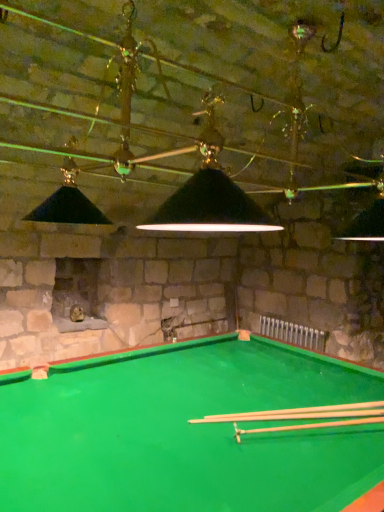
Locate an element on the screen. wooden cue at center, arranged as the 1th cue when viewed from the front is located at coordinates (310, 426).

The image size is (384, 512). Describe the element at coordinates (310, 426) in the screenshot. I see `wooden cue at center, which is the 2th cue in back-to-front order` at that location.

At what (x,y) coordinates should I click in order to perform the action: click on smooth wood cue at center, the 1th cue positioned from the back. Please return your answer as a coordinate pair (x, y). Looking at the image, I should click on (301, 413).

Describe the element at coordinates (301, 413) in the screenshot. This screenshot has height=512, width=384. I see `smooth wood cue at center, which appears as the 2th cue when viewed from the front` at that location.

What is the approximate width of smooth wood cue at center, which appears as the 2th cue when viewed from the front?

36.11 inches.

How much space does smooth wood cue at center, which appears as the 2th cue when viewed from the front, occupy vertically?

smooth wood cue at center, which appears as the 2th cue when viewed from the front, is 1.60 inches tall.

Where is `wooden cue at center, which is the 2th cue in back-to-front order`? The image size is (384, 512). wooden cue at center, which is the 2th cue in back-to-front order is located at coordinates (310, 426).

Considering the positions of objects wooden cue at center, arranged as the 1th cue when viewed from the front, and smooth wood cue at center, which appears as the 2th cue when viewed from the front, in the image provided, who is more to the left, wooden cue at center, arranged as the 1th cue when viewed from the front, or smooth wood cue at center, which appears as the 2th cue when viewed from the front,?

Positioned to the left is smooth wood cue at center, which appears as the 2th cue when viewed from the front.

Considering the positions of objects wooden cue at center, which is the 2th cue in back-to-front order, and smooth wood cue at center, the 1th cue positioned from the back, in the image provided, who is behind, wooden cue at center, which is the 2th cue in back-to-front order, or smooth wood cue at center, the 1th cue positioned from the back,?

Positioned behind is smooth wood cue at center, the 1th cue positioned from the back.

Which is farther from the camera, (x=366, y=416) or (x=333, y=417)?

Answer: The point (x=366, y=416) is farther.

From the image's perspective, who appears lower, wooden cue at center, which is the 2th cue in back-to-front order, or smooth wood cue at center, the 1th cue positioned from the back?

From the image's view, smooth wood cue at center, the 1th cue positioned from the back, is below.

From a real-world perspective, is wooden cue at center, arranged as the 1th cue when viewed from the front, on top of smooth wood cue at center, the 1th cue positioned from the back?

Yes, from a real-world perspective, wooden cue at center, arranged as the 1th cue when viewed from the front, is on top of smooth wood cue at center, the 1th cue positioned from the back.

Is wooden cue at center, arranged as the 1th cue when viewed from the front, wider than smooth wood cue at center, which appears as the 2th cue when viewed from the front?

Incorrect, the width of wooden cue at center, arranged as the 1th cue when viewed from the front, does not surpass that of smooth wood cue at center, which appears as the 2th cue when viewed from the front.

Considering the sizes of objects wooden cue at center, which is the 2th cue in back-to-front order, and smooth wood cue at center, which appears as the 2th cue when viewed from the front, in the image provided, who is taller, wooden cue at center, which is the 2th cue in back-to-front order, or smooth wood cue at center, which appears as the 2th cue when viewed from the front,?

wooden cue at center, which is the 2th cue in back-to-front order.

Which of these two, wooden cue at center, arranged as the 1th cue when viewed from the front, or smooth wood cue at center, which appears as the 2th cue when viewed from the front, is smaller?

smooth wood cue at center, which appears as the 2th cue when viewed from the front.

Do you think wooden cue at center, arranged as the 1th cue when viewed from the front, is within smooth wood cue at center, which appears as the 2th cue when viewed from the front, or outside of it?

wooden cue at center, arranged as the 1th cue when viewed from the front, exists outside the volume of smooth wood cue at center, which appears as the 2th cue when viewed from the front.

Are wooden cue at center, arranged as the 1th cue when viewed from the front, and smooth wood cue at center, which appears as the 2th cue when viewed from the front, far apart?

They are positioned close to each other.

Is wooden cue at center, arranged as the 1th cue when viewed from the front, aimed at smooth wood cue at center, the 1th cue positioned from the back?

No, wooden cue at center, arranged as the 1th cue when viewed from the front, is not facing towards smooth wood cue at center, the 1th cue positioned from the back.

Can you tell me how much wooden cue at center, arranged as the 1th cue when viewed from the front, and smooth wood cue at center, which appears as the 2th cue when viewed from the front, differ in facing direction?

wooden cue at center, arranged as the 1th cue when viewed from the front, and smooth wood cue at center, which appears as the 2th cue when viewed from the front, are facing 2.21 degrees away from each other.

The image size is (384, 512). I want to click on cue that appears on the left of wooden cue at center, arranged as the 1th cue when viewed from the front, so click(x=301, y=413).

Between smooth wood cue at center, the 1th cue positioned from the back, and wooden cue at center, arranged as the 1th cue when viewed from the front, which one appears on the left side from the viewer's perspective?

smooth wood cue at center, the 1th cue positioned from the back, is more to the left.

Does smooth wood cue at center, which appears as the 2th cue when viewed from the front, lie behind wooden cue at center, arranged as the 1th cue when viewed from the front?

Yes, it is behind wooden cue at center, arranged as the 1th cue when viewed from the front.

Consider the image. Which point is more forward, (333, 411) or (323, 422)?

Point (323, 422)

From the image's perspective, between smooth wood cue at center, which appears as the 2th cue when viewed from the front, and wooden cue at center, which is the 2th cue in back-to-front order, who is located below?

smooth wood cue at center, which appears as the 2th cue when viewed from the front, from the image's perspective.

In the scene shown: From a real-world perspective, is smooth wood cue at center, which appears as the 2th cue when viewed from the front, beneath wooden cue at center, which is the 2th cue in back-to-front order?

Yes.

Which of these two, smooth wood cue at center, the 1th cue positioned from the back, or wooden cue at center, arranged as the 1th cue when viewed from the front, is thinner?

wooden cue at center, arranged as the 1th cue when viewed from the front, is thinner.

Considering the sizes of objects smooth wood cue at center, the 1th cue positioned from the back, and wooden cue at center, arranged as the 1th cue when viewed from the front, in the image provided, who is shorter, smooth wood cue at center, the 1th cue positioned from the back, or wooden cue at center, arranged as the 1th cue when viewed from the front,?

smooth wood cue at center, the 1th cue positioned from the back.

Who is smaller, smooth wood cue at center, the 1th cue positioned from the back, or wooden cue at center, arranged as the 1th cue when viewed from the front?

smooth wood cue at center, the 1th cue positioned from the back, is smaller.

Do you think smooth wood cue at center, the 1th cue positioned from the back, is within wooden cue at center, arranged as the 1th cue when viewed from the front, or outside of it?

smooth wood cue at center, the 1th cue positioned from the back, cannot be found inside wooden cue at center, arranged as the 1th cue when viewed from the front.

Looking at this image, is smooth wood cue at center, the 1th cue positioned from the back, far away from wooden cue at center, which is the 2th cue in back-to-front order?

That's not correct — smooth wood cue at center, the 1th cue positioned from the back, is a little close to wooden cue at center, which is the 2th cue in back-to-front order.

Is wooden cue at center, which is the 2th cue in back-to-front order, at the back of smooth wood cue at center, which appears as the 2th cue when viewed from the front?

No, smooth wood cue at center, which appears as the 2th cue when viewed from the front, is not facing the opposite direction of wooden cue at center, which is the 2th cue in back-to-front order.

What's the angular difference between smooth wood cue at center, which appears as the 2th cue when viewed from the front, and wooden cue at center, which is the 2th cue in back-to-front order,'s facing directions?

smooth wood cue at center, which appears as the 2th cue when viewed from the front, and wooden cue at center, which is the 2th cue in back-to-front order, are facing 2.21 degrees away from each other.

Where is `cue lying below the wooden cue at center, arranged as the 1th cue when viewed from the front (from the image's perspective)`? The width and height of the screenshot is (384, 512). cue lying below the wooden cue at center, arranged as the 1th cue when viewed from the front (from the image's perspective) is located at coordinates (301, 413).

At what (x,y) coordinates should I click in order to perform the action: click on cue above the smooth wood cue at center, which appears as the 2th cue when viewed from the front (from a real-world perspective). Please return your answer as a coordinate pair (x, y). Looking at the image, I should click on tap(310, 426).

This screenshot has height=512, width=384. I want to click on cue in front of the smooth wood cue at center, the 1th cue positioned from the back, so click(310, 426).